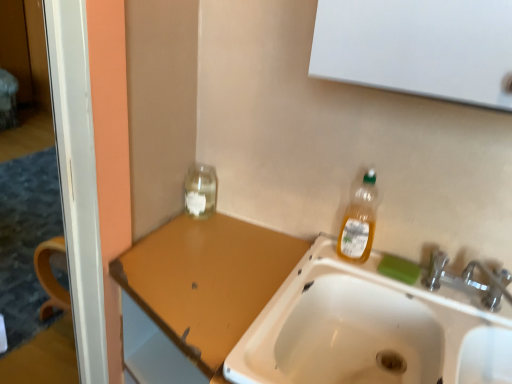
Locate an element on the screen. This screenshot has height=384, width=512. vacant area that is in front of transparent glass jar at upper left is located at coordinates (188, 244).